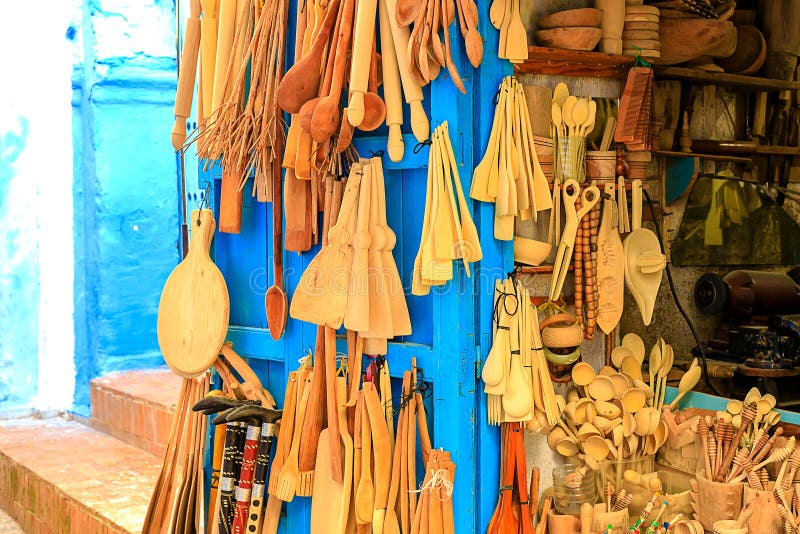
Locate an element on the screen. This screenshot has height=534, width=800. wooden rolling pin is located at coordinates (366, 48), (394, 74), (401, 59), (185, 68), (198, 67), (220, 47), (238, 7), (214, 13).